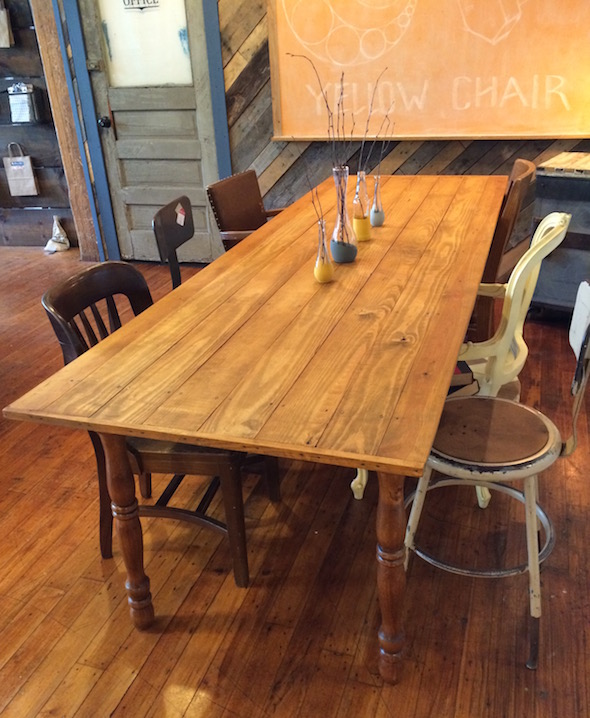
This screenshot has width=590, height=718. Find the location of `two table legs`. two table legs is located at coordinates (137, 573), (388, 601).